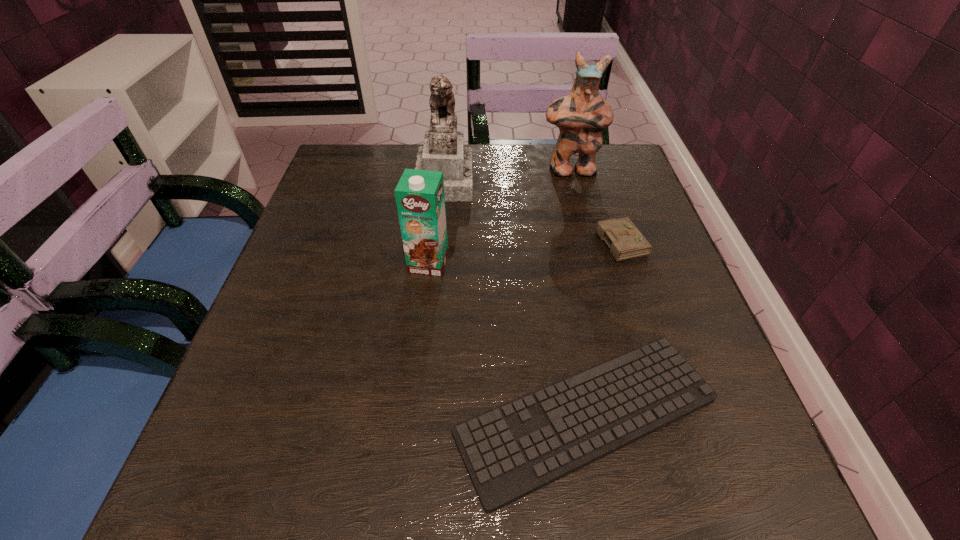
In the image, there is a desktop. At what (x,y) coordinates should I click in order to perform the action: click on free space at the far left corner. Please return your answer as a coordinate pair (x, y). The width and height of the screenshot is (960, 540). Looking at the image, I should click on (336, 165).

Identify the location of vacant space at the far right corner. (618, 187).

Locate an element on the screen. This screenshot has width=960, height=540. free area in between the left figurine and the right figurine is located at coordinates click(x=507, y=174).

Identify the location of empty location between the third shortest object and the right figurine. The image size is (960, 540). (499, 217).

Where is `free spot between the right figurine and the third shortest object`? The width and height of the screenshot is (960, 540). free spot between the right figurine and the third shortest object is located at coordinates (499, 217).

Find the location of `empty space between the shortest object and the carton`. empty space between the shortest object and the carton is located at coordinates (508, 339).

The width and height of the screenshot is (960, 540). Identify the location of free space between the left figurine and the second shortest object. (532, 210).

Locate an element on the screen. The image size is (960, 540). free point between the second shortest object and the left figurine is located at coordinates (532, 210).

The image size is (960, 540). I want to click on vacant area that lies between the diary and the carton, so click(524, 251).

Identify the location of free space between the right figurine and the third tallest object. The height and width of the screenshot is (540, 960). (499, 217).